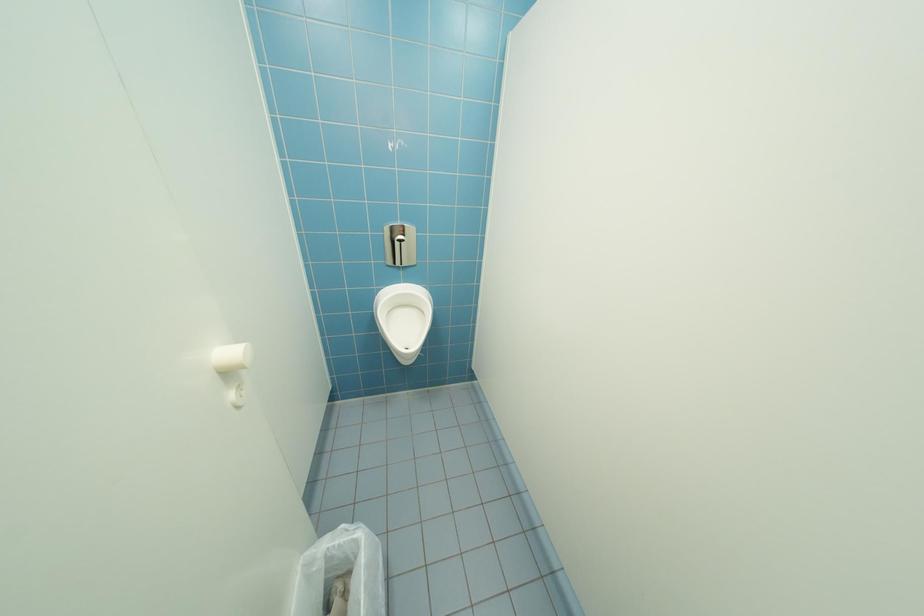
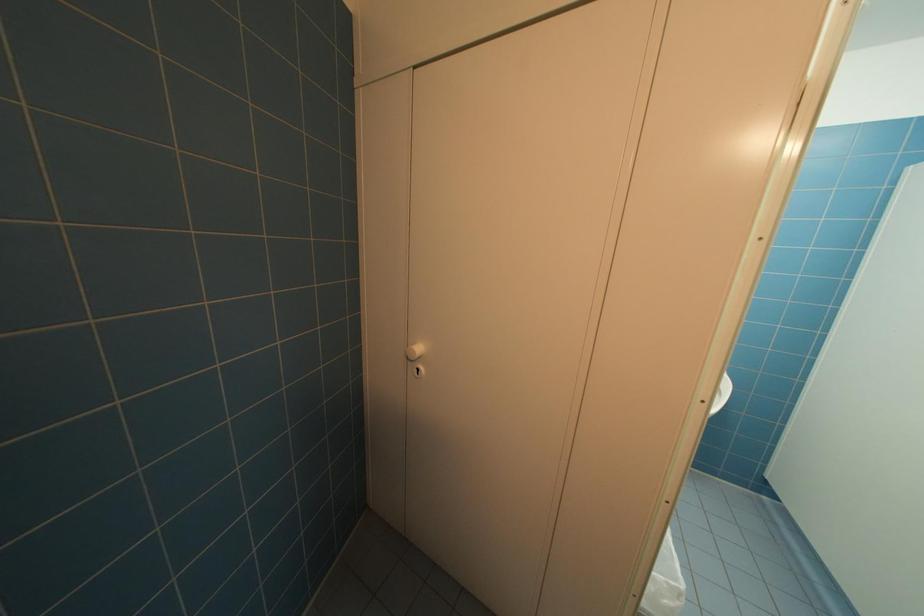
Question: The camera is either moving clockwise (left) or counter-clockwise (right) around the object. The first image is from the beginning of the video and the second image is from the end. Is the camera moving left or right when shooting the video?

Choices:
 (A) Left
 (B) Right

Answer: (B)